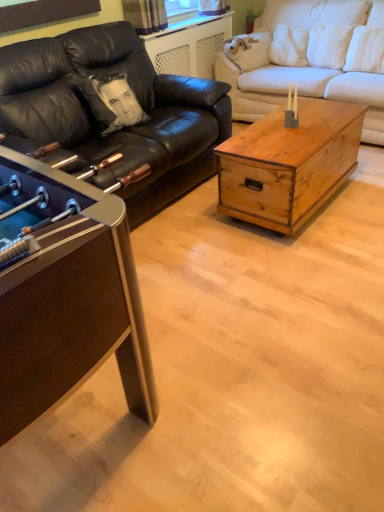
Where is `free space to the left of rustic wood trunk at center, which appears as the 1th coffee table when viewed from the right`? The image size is (384, 512). free space to the left of rustic wood trunk at center, which appears as the 1th coffee table when viewed from the right is located at coordinates (186, 230).